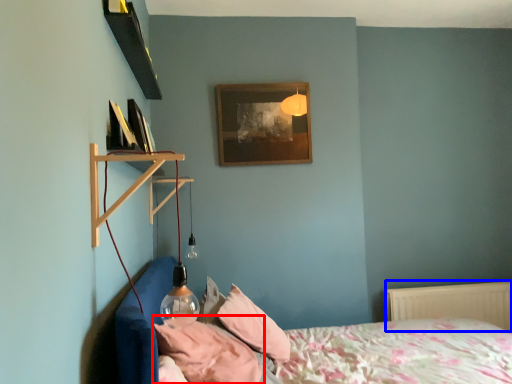
Question: Which object appears closest to the camera in this image, pillow (highlighted by a red box) or radiator (highlighted by a blue box)?

Choices:
 (A) pillow
 (B) radiator

Answer: (A)